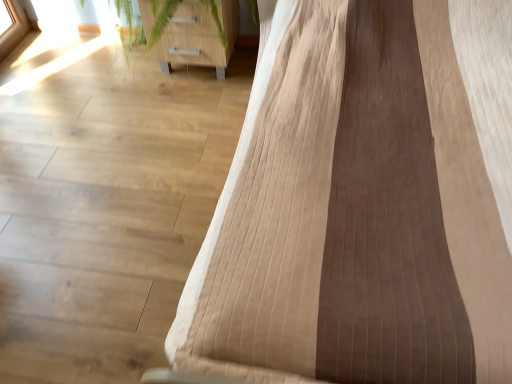
Question: Would you say brown textured fabric at right, the first furniture when ordered from right to left, contains wooden cabinet at upper left, which appears as the 1th furniture when viewed from the left?

Choices:
 (A) yes
 (B) no

Answer: (B)

Question: Considering the relative sizes of brown textured fabric at right, which is counted as the second furniture, starting from the left, and wooden cabinet at upper left, which appears as the 1th furniture when viewed from the left, in the image provided, is brown textured fabric at right, which is counted as the second furniture, starting from the left, taller than wooden cabinet at upper left, which appears as the 1th furniture when viewed from the left,?

Choices:
 (A) yes
 (B) no

Answer: (A)

Question: Is brown textured fabric at right, which is counted as the second furniture, starting from the left, smaller than wooden cabinet at upper left, which is the 2th furniture from right to left?

Choices:
 (A) yes
 (B) no

Answer: (B)

Question: Can you confirm if brown textured fabric at right, which is counted as the second furniture, starting from the left, is shorter than wooden cabinet at upper left, which is the 2th furniture from right to left?

Choices:
 (A) no
 (B) yes

Answer: (A)

Question: Is brown textured fabric at right, the first furniture when ordered from right to left, touching wooden cabinet at upper left, which is the 2th furniture from right to left?

Choices:
 (A) yes
 (B) no

Answer: (B)

Question: Is the position of brown textured fabric at right, which is counted as the second furniture, starting from the left, more distant than that of wooden cabinet at upper left, which is the 2th furniture from right to left?

Choices:
 (A) yes
 (B) no

Answer: (B)

Question: Is wooden cabinet at upper left, which appears as the 1th furniture when viewed from the left, outside brown textured fabric at right, the first furniture when ordered from right to left?

Choices:
 (A) no
 (B) yes

Answer: (B)

Question: From the image's perspective, does wooden cabinet at upper left, which appears as the 1th furniture when viewed from the left, appear higher than brown textured fabric at right, the first furniture when ordered from right to left?

Choices:
 (A) no
 (B) yes

Answer: (B)

Question: Does wooden cabinet at upper left, which is the 2th furniture from right to left, contain brown textured fabric at right, which is counted as the second furniture, starting from the left?

Choices:
 (A) no
 (B) yes

Answer: (A)

Question: Does wooden cabinet at upper left, which appears as the 1th furniture when viewed from the left, have a smaller size compared to brown textured fabric at right, which is counted as the second furniture, starting from the left?

Choices:
 (A) no
 (B) yes

Answer: (B)

Question: Is wooden cabinet at upper left, which appears as the 1th furniture when viewed from the left, touching brown textured fabric at right, the first furniture when ordered from right to left?

Choices:
 (A) yes
 (B) no

Answer: (B)

Question: Is wooden cabinet at upper left, which appears as the 1th furniture when viewed from the left, closer to camera compared to brown textured fabric at right, the first furniture when ordered from right to left?

Choices:
 (A) no
 (B) yes

Answer: (A)

Question: From the image's perspective, is brown textured fabric at right, the first furniture when ordered from right to left, above or below wooden cabinet at upper left, which is the 2th furniture from right to left?

Choices:
 (A) above
 (B) below

Answer: (B)